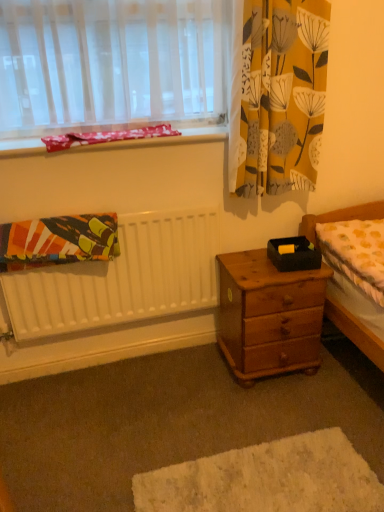
The width and height of the screenshot is (384, 512). I want to click on empty space that is ontop of white matte radiator at left, so click(x=69, y=212).